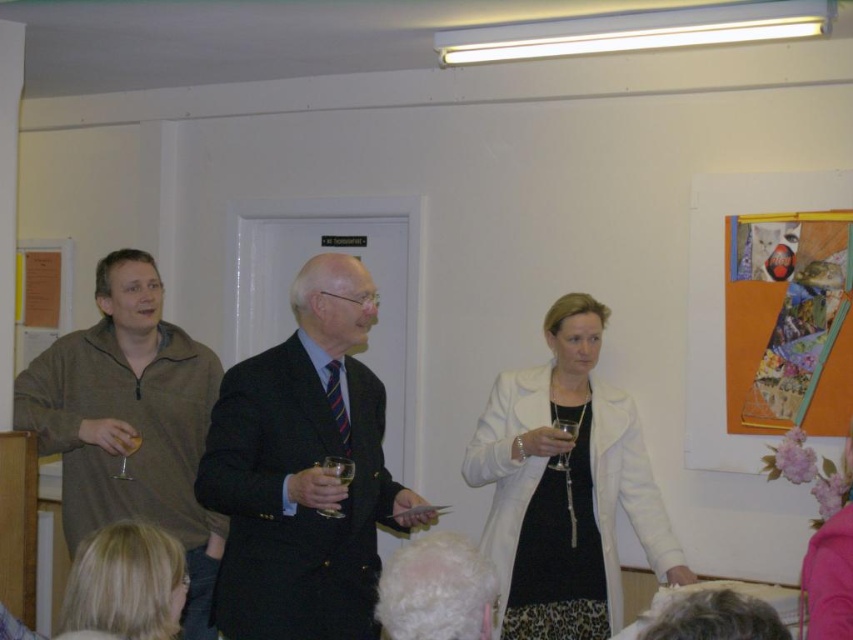
Is white matte coat at center bigger than blonde hair at lower left?

Indeed, white matte coat at center has a larger size compared to blonde hair at lower left.

Image resolution: width=853 pixels, height=640 pixels. What do you see at coordinates (566, 486) in the screenshot? I see `white matte coat at center` at bounding box center [566, 486].

Describe the element at coordinates (566, 486) in the screenshot. I see `white matte coat at center` at that location.

Find the location of a particular element. white matte coat at center is located at coordinates (566, 486).

Between matte brown sweater at left and floral fabric at lower right, which one appears on the right side from the viewer's perspective?

From the viewer's perspective, floral fabric at lower right appears more on the right side.

Can you confirm if matte brown sweater at left is taller than floral fabric at lower right?

Yes, matte brown sweater at left is taller than floral fabric at lower right.

Measure the distance between point (192, 580) and camera.

Point (192, 580) and camera are 9.09 feet apart.

You are a GUI agent. You are given a task and a screenshot of the screen. Output one action in this format:
    pyautogui.click(x=<x>, y=<y>)
    Task: Click on the matte brown sweater at left
    The width and height of the screenshot is (853, 640).
    Given the screenshot: What is the action you would take?
    pyautogui.click(x=129, y=420)

Which is more to the right, clear glass wine at center or transparent glass at center?

transparent glass at center is more to the right.

Which is in front, point (335, 464) or point (563, 460)?

Point (335, 464) is more forward.

Does point (352, 461) come closer to viewer compared to point (563, 422)?

Yes, it is in front of point (563, 422).

Where is `clear glass wine at center`? This screenshot has height=640, width=853. clear glass wine at center is located at coordinates coord(340,467).